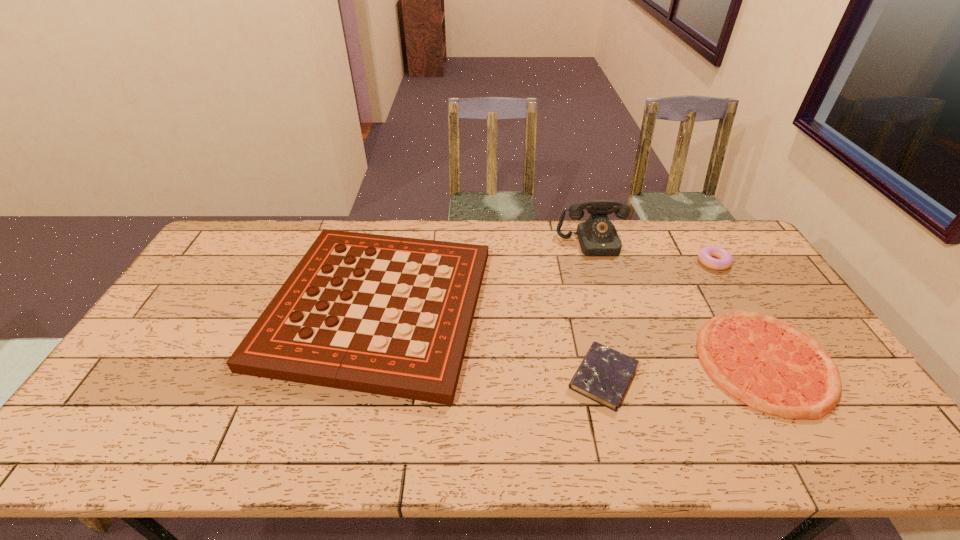
Find the location of a particular element. This screenshot has height=540, width=960. object that can be found as the second closest to the second tallest object is located at coordinates (597, 236).

At what (x,y) coordinates should I click in order to perform the action: click on the third closest object to the telephone. Please return your answer as a coordinate pair (x, y). Image resolution: width=960 pixels, height=540 pixels. Looking at the image, I should click on (772, 366).